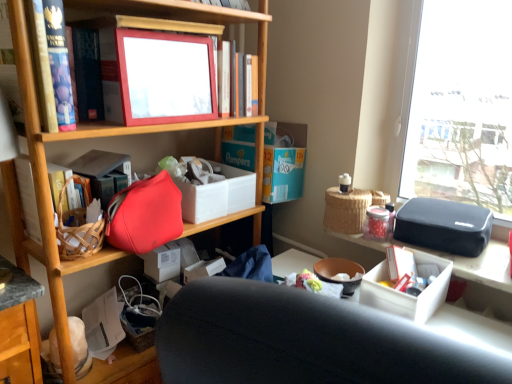
Question: Could matte plastic picture frame at upper center be considered to be inside matte red book at left, arranged as the 2th book when viewed from the right?

Choices:
 (A) yes
 (B) no

Answer: (B)

Question: Is there a large distance between matte red book at left, the first book when ordered from left to right, and matte plastic picture frame at upper center?

Choices:
 (A) no
 (B) yes

Answer: (A)

Question: Does matte red book at left, arranged as the 2th book when viewed from the right, have a greater height compared to matte plastic picture frame at upper center?

Choices:
 (A) no
 (B) yes

Answer: (A)

Question: Can you confirm if matte red book at left, arranged as the 2th book when viewed from the right, is wider than matte plastic picture frame at upper center?

Choices:
 (A) yes
 (B) no

Answer: (A)

Question: Does matte red book at left, arranged as the 2th book when viewed from the right, have a larger size compared to matte plastic picture frame at upper center?

Choices:
 (A) no
 (B) yes

Answer: (B)

Question: Does matte red book at left, marked as the first book in a bottom-to-top arrangement, have a smaller size compared to matte plastic picture frame at upper center?

Choices:
 (A) no
 (B) yes

Answer: (A)

Question: From the image's perspective, is matte plastic picture frame at upper center over matte red handbag at center-left?

Choices:
 (A) no
 (B) yes

Answer: (B)

Question: Is matte red handbag at center-left located within matte plastic picture frame at upper center?

Choices:
 (A) yes
 (B) no

Answer: (B)

Question: Is matte plastic picture frame at upper center positioned beyond the bounds of matte red handbag at center-left?

Choices:
 (A) yes
 (B) no

Answer: (A)

Question: From a real-world perspective, is matte plastic picture frame at upper center beneath matte red handbag at center-left?

Choices:
 (A) yes
 (B) no

Answer: (B)

Question: Can you confirm if matte plastic picture frame at upper center is positioned to the right of matte red handbag at center-left?

Choices:
 (A) no
 (B) yes

Answer: (B)

Question: Is matte plastic picture frame at upper center positioned far away from matte red handbag at center-left?

Choices:
 (A) yes
 (B) no

Answer: (B)

Question: From the image's perspective, is matte plastic picture frame at upper center above matte plastic picture frame at upper center, which is the second book from left to right?

Choices:
 (A) yes
 (B) no

Answer: (B)